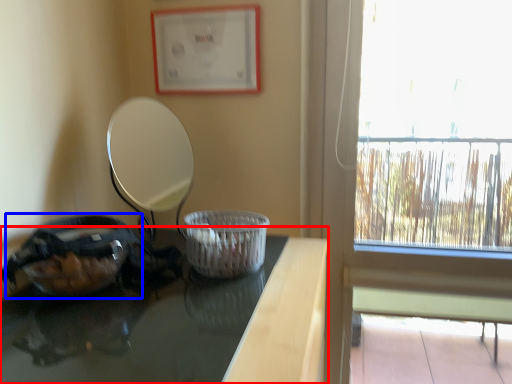
Question: Which point is closer to the camera, table (highlighted by a red box) or glass bowl (highlighted by a blue box)?

Choices:
 (A) table
 (B) glass bowl

Answer: (A)